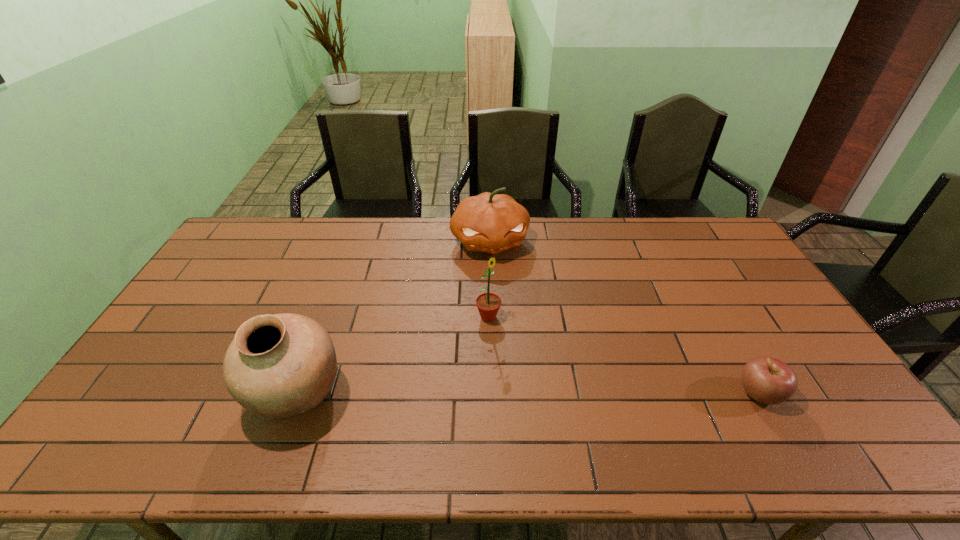
This screenshot has height=540, width=960. I want to click on the leftmost object, so click(x=279, y=366).

In order to click on apple in this screenshot , I will do `click(767, 380)`.

This screenshot has width=960, height=540. Find the location of `the shortest object`. the shortest object is located at coordinates (767, 380).

Identify the location of the third nearest object. The image size is (960, 540). (488, 304).

Find the location of a particular element. The image size is (960, 540). pumpkin is located at coordinates click(x=489, y=222).

This screenshot has width=960, height=540. Find the location of `vacant region located 0.240m on the left of the pottery`. vacant region located 0.240m on the left of the pottery is located at coordinates (156, 394).

Where is `vacant area situated 0.140m on the side of the shortest object with the unique marking`? vacant area situated 0.140m on the side of the shortest object with the unique marking is located at coordinates (836, 393).

Where is `vacant point located 0.170m on the face of the sunflower`? Image resolution: width=960 pixels, height=540 pixels. vacant point located 0.170m on the face of the sunflower is located at coordinates (539, 357).

At what (x,y) coordinates should I click in order to perform the action: click on vacant position located 0.260m on the face of the sunflower. Please return your answer as a coordinate pair (x, y). Looking at the image, I should click on (563, 377).

I want to click on free space located 0.210m on the face of the sunflower, so click(549, 366).